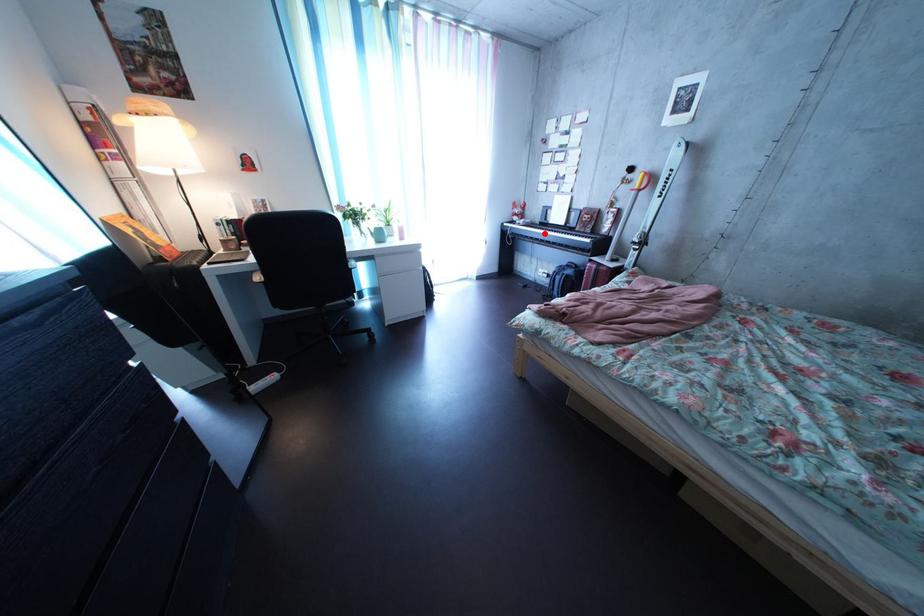
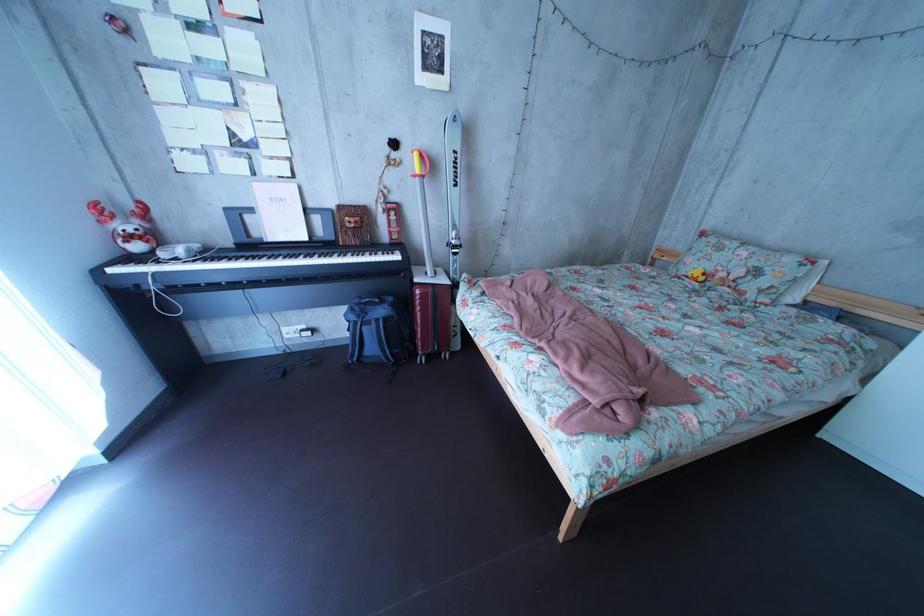
The point at the highlighted location is marked in the first image. Where is the corresponding point in the second image?

(225, 262)